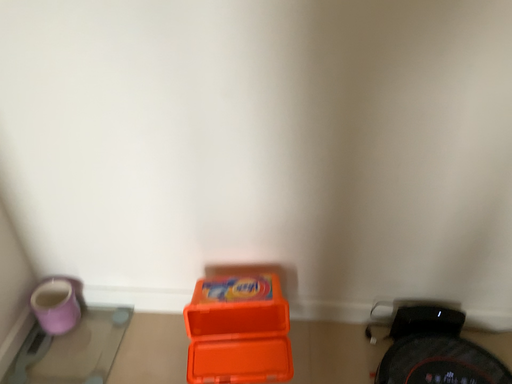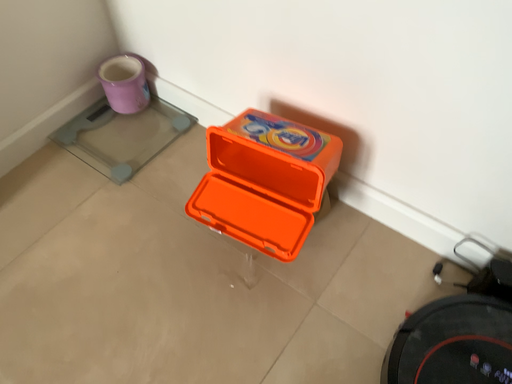
Question: How did the camera likely rotate when shooting the video?

Choices:
 (A) rotated upward
 (B) rotated downward

Answer: (B)